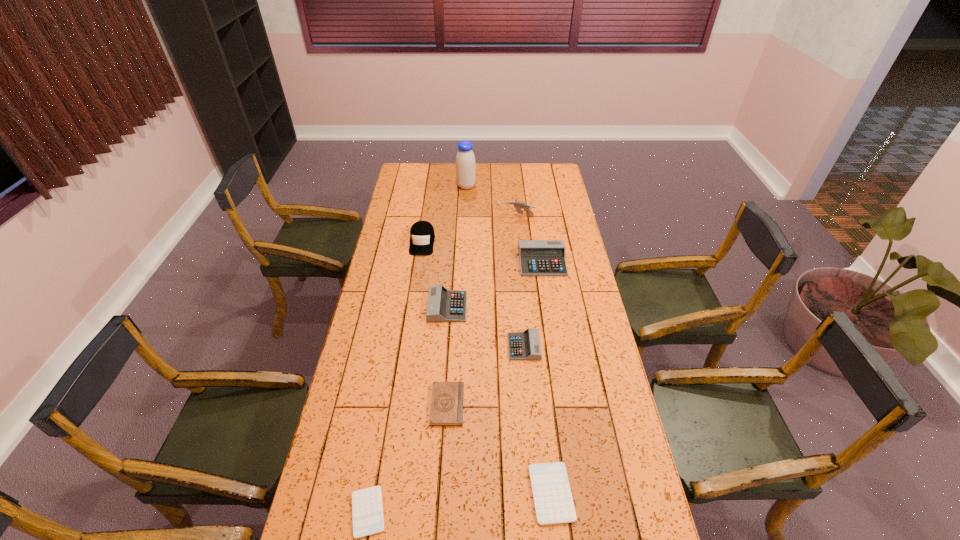
You are a GUI agent. You are given a task and a screenshot of the screen. Output one action in this format:
    pyautogui.click(x=<x>, y=<y>)
    Task: Click on the vacant space situated 0.120m on the front-facing side of the black cap
    
    Given the screenshot: What is the action you would take?
    pyautogui.click(x=418, y=275)

Image resolution: width=960 pixels, height=540 pixels. I want to click on free region located on the left of the sixth shortest object, so 441,262.

Where is `vacant space located 0.290m on the back of the fifth nearest object`? vacant space located 0.290m on the back of the fifth nearest object is located at coordinates (452, 247).

Identify the location of free space located 0.170m on the front of the sixth tallest object. This screenshot has height=540, width=960. (529, 404).

You are a GUI agent. You are given a task and a screenshot of the screen. Output one action in this format:
    pyautogui.click(x=<x>, y=<y>)
    Task: Click on the vacant region located 0.310m on the spine side of the seventh farthest object
    The height and width of the screenshot is (540, 960).
    Given the screenshot: What is the action you would take?
    pyautogui.click(x=562, y=404)

Locate an element on the screen. This screenshot has width=960, height=540. free spot located 0.390m on the back of the eighth tallest object is located at coordinates (536, 353).

You are a GUI agent. You are given a task and a screenshot of the screen. Output one action in this format:
    pyautogui.click(x=<x>, y=<y>)
    Task: Click on the blank area located 0.330m on the back of the shortest object
    This screenshot has height=540, width=960.
    Given the screenshot: What is the action you would take?
    pyautogui.click(x=390, y=383)

Where is `object located in the far edge section of the desktop`? object located in the far edge section of the desktop is located at coordinates (465, 160).

You are a GUI agent. You are given a task and a screenshot of the screen. Output one action in this format:
    pyautogui.click(x=<x>, y=<y>)
    Task: Click on the cap that is at the left edge
    
    Given the screenshot: What is the action you would take?
    pyautogui.click(x=422, y=236)

At what (x,y) coordinates should I click in order to perform the action: click on calculator that is at the left edge. Please return your answer as a coordinate pair (x, y). Image resolution: width=960 pixels, height=540 pixels. Looking at the image, I should click on (367, 511).